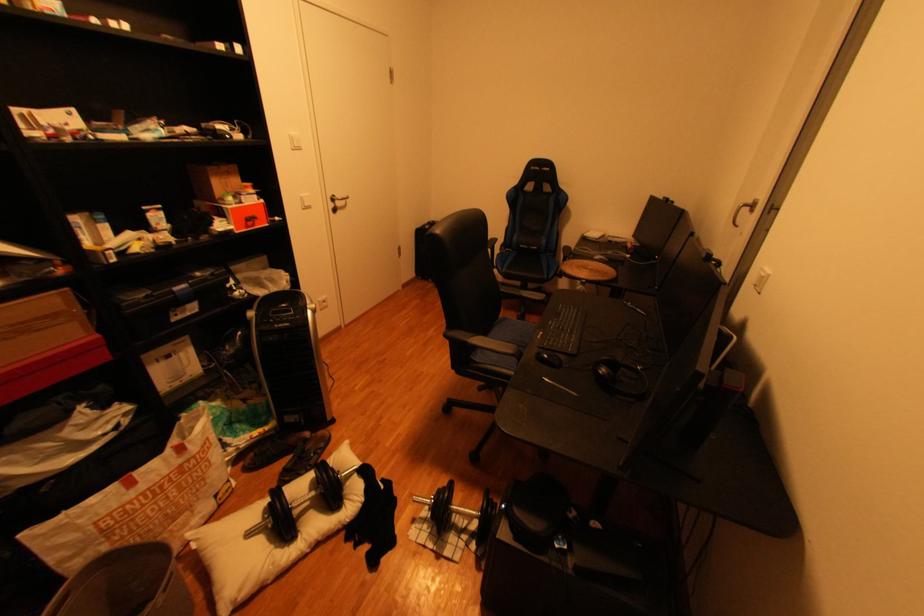
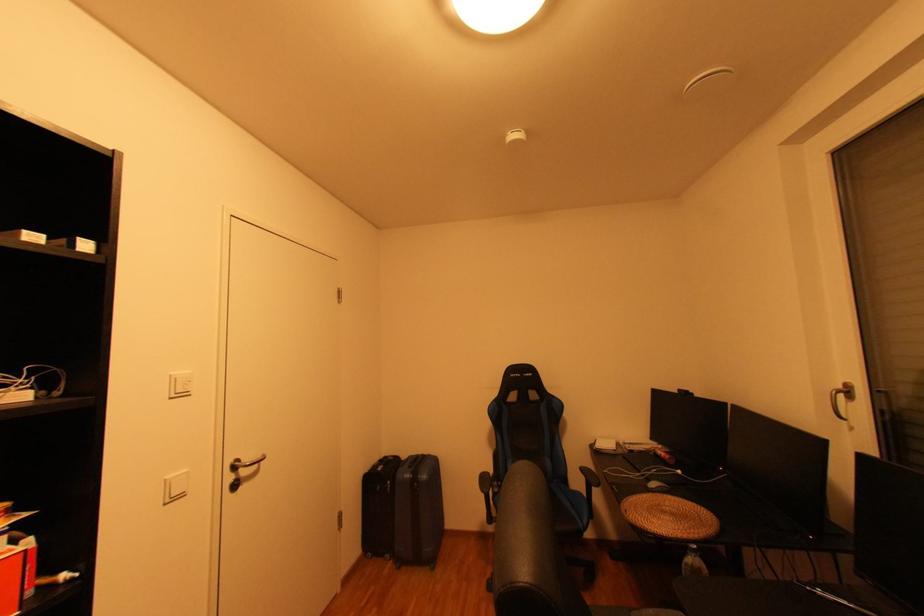
Find the pixel in the second image that matches (430,278) in the first image.

(380, 554)